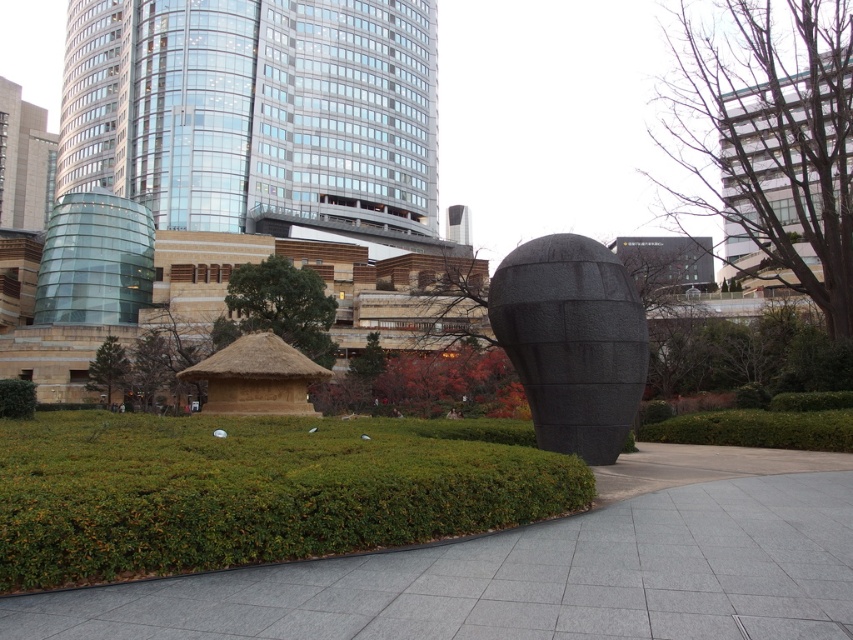
Question: Does green leafy grass at center have a greater width compared to green thatch hut at center?

Choices:
 (A) yes
 (B) no

Answer: (B)

Question: Which point is farther from the camera taking this photo?

Choices:
 (A) (323, 324)
 (B) (567, 292)
 (C) (15, 408)
 (D) (572, 483)

Answer: (A)

Question: Among these objects, which one is nearest to the camera?

Choices:
 (A) green thatch hut at center
 (B) granite sculpture at center
 (C) green leafy grass at center

Answer: (C)

Question: Can you confirm if green leafy grass at center is thinner than granite sculpture at center?

Choices:
 (A) yes
 (B) no

Answer: (B)

Question: Based on their relative distances, which object is farther from the granite sculpture at center?

Choices:
 (A) green thatch hut at center
 (B) green leafy hedge at lower left
 (C) green leafy grass at center

Answer: (A)

Question: Does granite sculpture at center come behind green thatch hut at center?

Choices:
 (A) yes
 (B) no

Answer: (B)